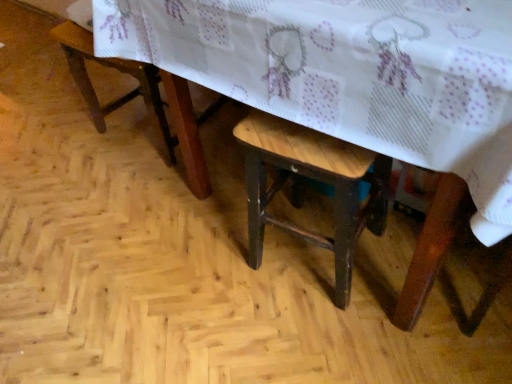
Question: Is wooden table at center to the right of wooden stool at center from the viewer's perspective?

Choices:
 (A) no
 (B) yes

Answer: (B)

Question: Considering the relative sizes of wooden table at center and wooden stool at center in the image provided, is wooden table at center smaller than wooden stool at center?

Choices:
 (A) no
 (B) yes

Answer: (A)

Question: From the image's perspective, is wooden table at center under wooden stool at center?

Choices:
 (A) yes
 (B) no

Answer: (B)

Question: Considering the relative sizes of wooden table at center and wooden stool at center in the image provided, is wooden table at center wider than wooden stool at center?

Choices:
 (A) yes
 (B) no

Answer: (A)

Question: Is wooden table at center looking in the opposite direction of wooden stool at center?

Choices:
 (A) yes
 (B) no

Answer: (A)

Question: Is wooden table at center spatially inside wooden stool at lower left, or outside of it?

Choices:
 (A) outside
 (B) inside

Answer: (A)

Question: Is wooden table at center wider or thinner than wooden stool at lower left?

Choices:
 (A) wide
 (B) thin

Answer: (A)

Question: Does point (365, 145) appear closer or farther from the camera than point (94, 109)?

Choices:
 (A) farther
 (B) closer

Answer: (B)

Question: In the image, is wooden table at center positioned in front of or behind wooden stool at lower left?

Choices:
 (A) behind
 (B) front

Answer: (B)

Question: Looking at their shapes, would you say wooden stool at lower left is wider or thinner than wooden stool at center?

Choices:
 (A) thin
 (B) wide

Answer: (B)

Question: Would you say wooden stool at lower left is to the left or to the right of wooden stool at center in the picture?

Choices:
 (A) right
 (B) left

Answer: (B)

Question: Choose the correct answer: Is wooden stool at lower left inside wooden stool at center or outside it?

Choices:
 (A) outside
 (B) inside

Answer: (A)

Question: Considering their positions, is wooden stool at lower left located in front of or behind wooden stool at center?

Choices:
 (A) front
 (B) behind

Answer: (B)

Question: Does point (94, 96) appear closer or farther from the camera than point (510, 41)?

Choices:
 (A) farther
 (B) closer

Answer: (A)

Question: From the image's perspective, is wooden stool at lower left positioned above or below wooden table at center?

Choices:
 (A) above
 (B) below

Answer: (A)